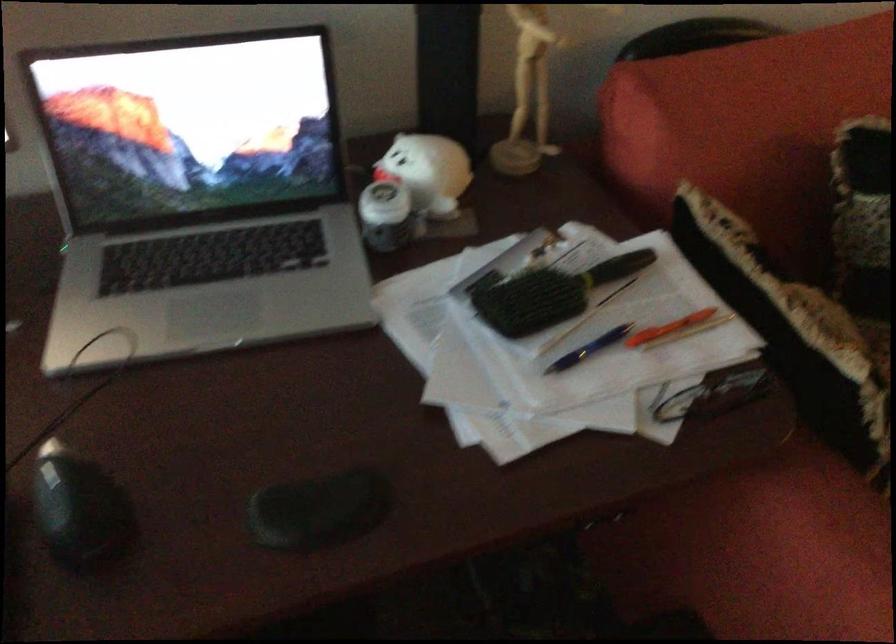
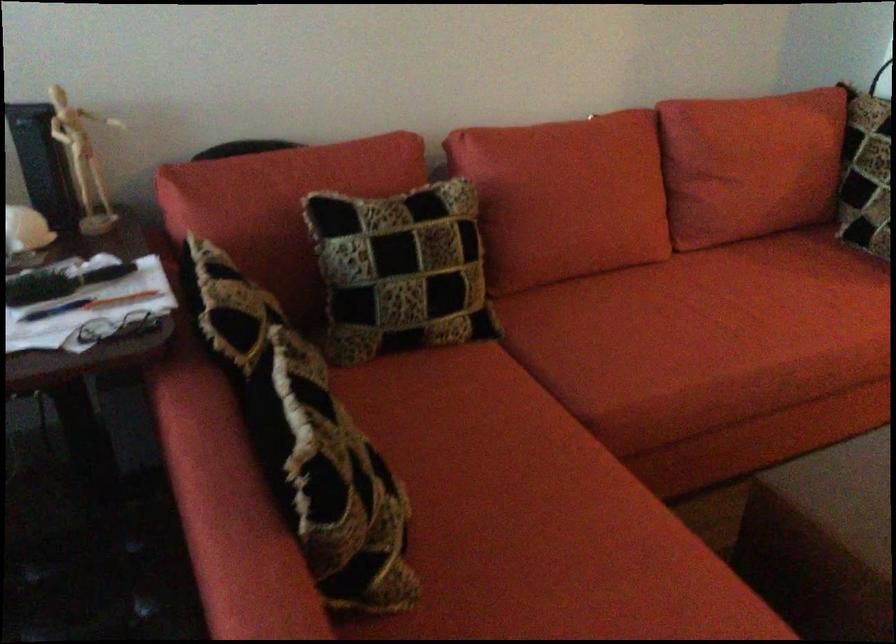
In the second image, find the point that corresponds to point (661, 308) in the first image.

(122, 299)